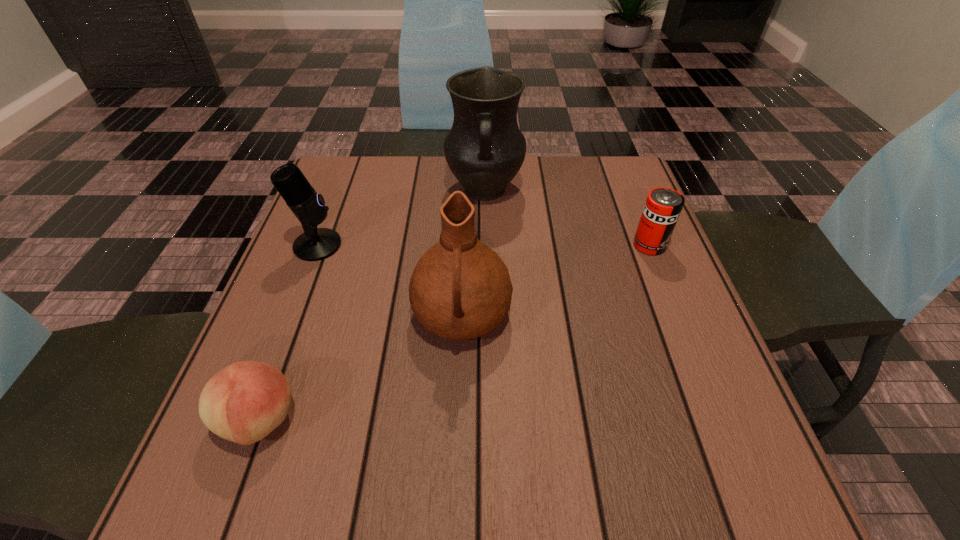
Where is `the farther pitcher`? the farther pitcher is located at coordinates (484, 149).

At what (x,y) coordinates should I click in order to perform the action: click on the nearer pitcher. Please return your answer as a coordinate pair (x, y). This screenshot has height=540, width=960. Looking at the image, I should click on (460, 289).

Identify the location of microphone. Image resolution: width=960 pixels, height=540 pixels. (315, 244).

In order to click on the fourth tallest object in this screenshot , I will do (x=663, y=206).

Find the location of a particular element. The height and width of the screenshot is (540, 960). the rightmost object is located at coordinates (663, 206).

Locate an element on the screen. Image resolution: width=960 pixels, height=540 pixels. the shortest object is located at coordinates (244, 402).

Locate an element on the screen. the nearest object is located at coordinates (244, 402).

Locate an element on the screen. Image resolution: width=960 pixels, height=540 pixels. vacant position located 0.230m on the handle side of the farther pitcher is located at coordinates (486, 285).

Where is `free point located 0.220m on the side of the second nearest object with the handle`? This screenshot has height=540, width=960. free point located 0.220m on the side of the second nearest object with the handle is located at coordinates (455, 489).

Identify the location of free space located 0.150m on the stand of the microphone. This screenshot has height=540, width=960. 406,245.